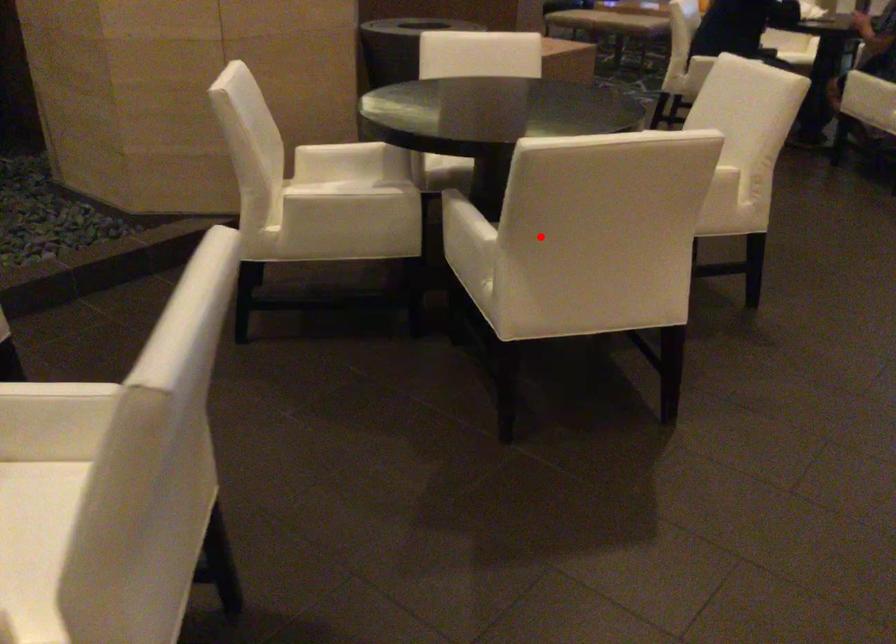
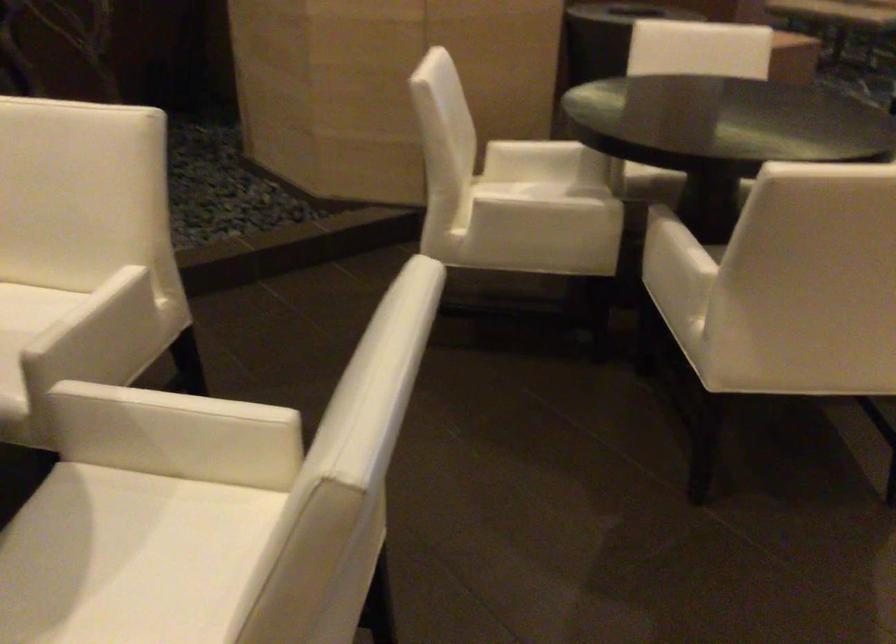
Question: I am providing you with two images of the same scene from different viewpoints. Image1 has a red point marked. In image2, the corresponding 3D location appears at what relative position? Reply with the corresponding letter.

Choices:
 (A) Closer
 (B) Farther

Answer: (A)